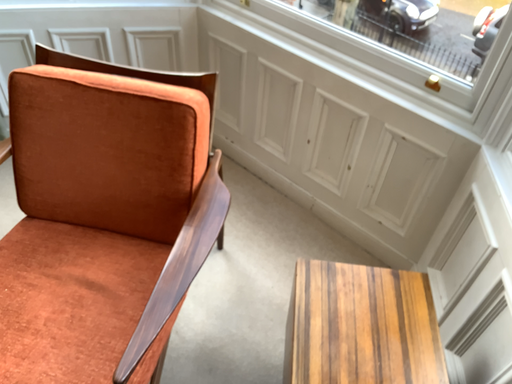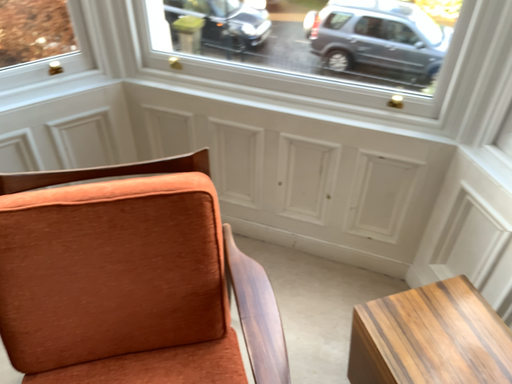
Question: How did the camera likely rotate when shooting the video?

Choices:
 (A) rotated left
 (B) rotated right

Answer: (B)